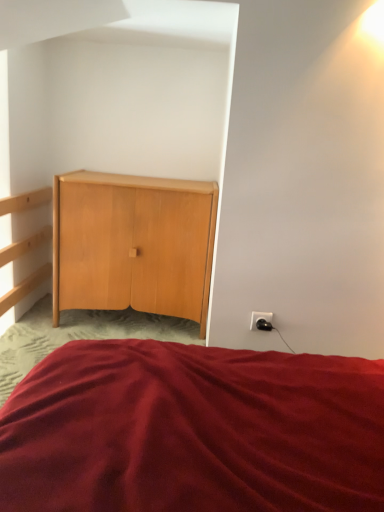
Question: From a real-world perspective, is black plastic outlet at lower right positioned above or below burgundy fabric bed at center?

Choices:
 (A) below
 (B) above

Answer: (B)

Question: Would you say black plastic outlet at lower right is inside or outside burgundy fabric bed at center?

Choices:
 (A) inside
 (B) outside

Answer: (B)

Question: Estimate the real-world distances between objects in this image. Which object is farther from the burgundy fabric bed at center?

Choices:
 (A) black plastic outlet at lower right
 (B) light wood cabinet at center

Answer: (B)

Question: Estimate the real-world distances between objects in this image. Which object is farther from the burgundy fabric bed at center?

Choices:
 (A) light wood cabinet at center
 (B) black plastic outlet at lower right

Answer: (A)